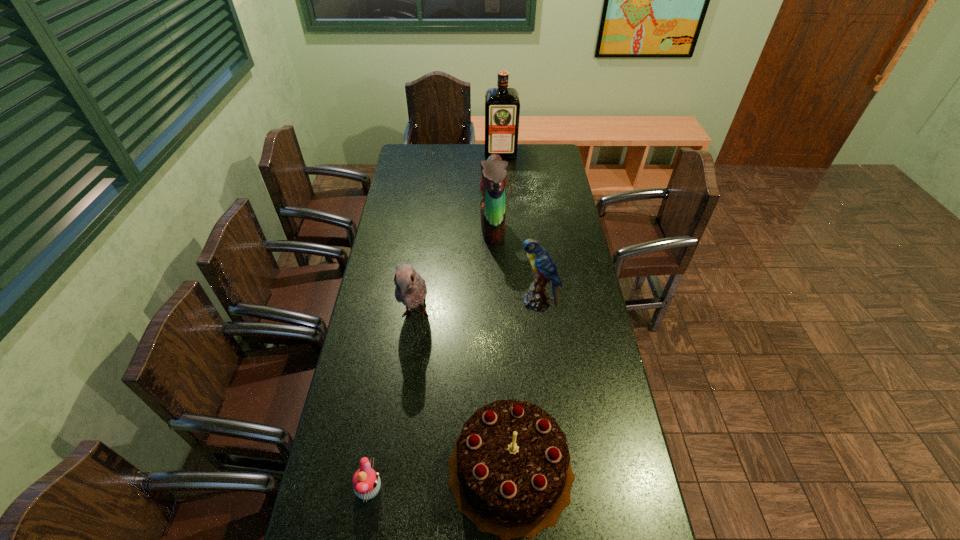
At what (x,y) coordinates should I click in order to perform the action: click on vacant space located 0.070m at the face of the second parrot from left to right. Please return your answer as a coordinate pair (x, y). The width and height of the screenshot is (960, 540). Looking at the image, I should click on (464, 228).

Where is `vacant space located on the face of the rightmost parrot`? This screenshot has height=540, width=960. vacant space located on the face of the rightmost parrot is located at coordinates (493, 303).

You are a GUI agent. You are given a task and a screenshot of the screen. Output one action in this format:
    pyautogui.click(x=<x>, y=<y>)
    Task: Click on the vacant space situated on the face of the rightmost parrot
    
    Given the screenshot: What is the action you would take?
    pyautogui.click(x=499, y=303)

This screenshot has width=960, height=540. Find the location of `free region located on the face of the rightmost parrot`. free region located on the face of the rightmost parrot is located at coordinates (426, 303).

Locate an element on the screen. This screenshot has height=540, width=960. free spot located on the front-facing side of the leftmost parrot is located at coordinates (396, 460).

Where is `vacant space situated on the face of the shortest object`? Image resolution: width=960 pixels, height=540 pixels. vacant space situated on the face of the shortest object is located at coordinates (502, 489).

The width and height of the screenshot is (960, 540). Find the location of `object positioned at the far edge`. object positioned at the far edge is located at coordinates (502, 105).

At what (x,y) coordinates should I click in order to perform the action: click on parrot that is positioned at the left edge. Please return your answer as a coordinate pair (x, y). The width and height of the screenshot is (960, 540). Looking at the image, I should click on (411, 290).

Where is `cupcake that is positioned at the left edge`? This screenshot has height=540, width=960. cupcake that is positioned at the left edge is located at coordinates (366, 483).

I want to click on object at the right edge, so click(536, 299).